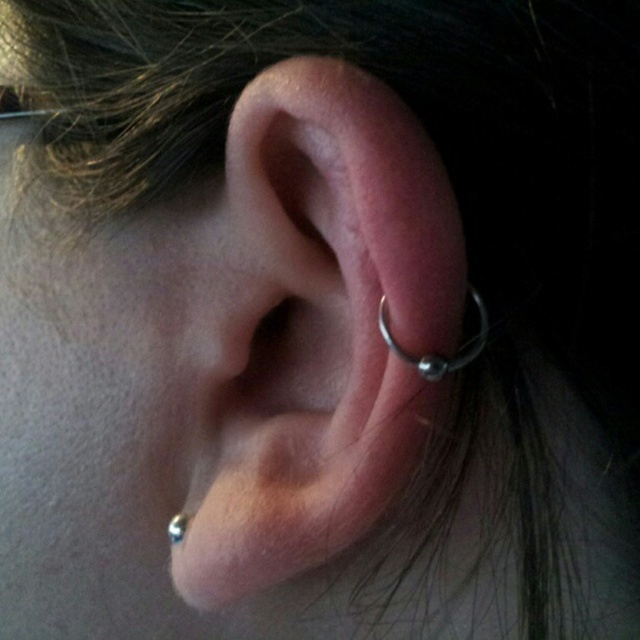
Does silver metallic hoop at center have a greater width compared to silver metallic ring at ear?

Yes.

Which is behind, point (422, 170) or point (173, 540)?

Positioned behind is point (173, 540).

Image resolution: width=640 pixels, height=640 pixels. In order to click on silver metallic hoop at center in this screenshot , I will do `click(314, 324)`.